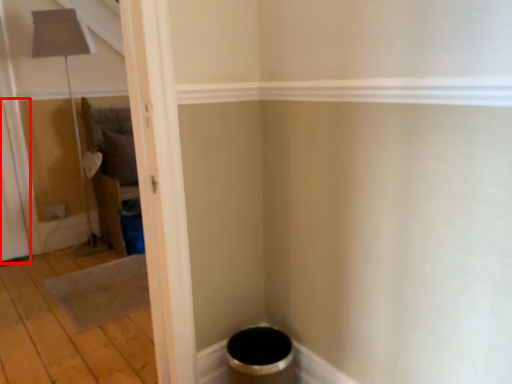
Question: Considering the relative positions of screen door (annotated by the red box) and plywood in the image provided, where is screen door (annotated by the red box) located with respect to the staircase?

Choices:
 (A) right
 (B) left

Answer: (B)